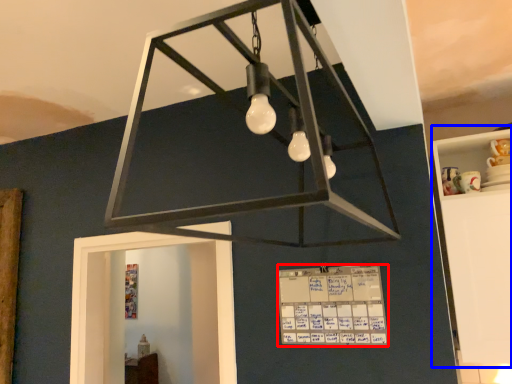
Question: Which point is further to the camera, writing (highlighted by a red box) or furniture (highlighted by a blue box)?

Choices:
 (A) writing
 (B) furniture

Answer: (B)